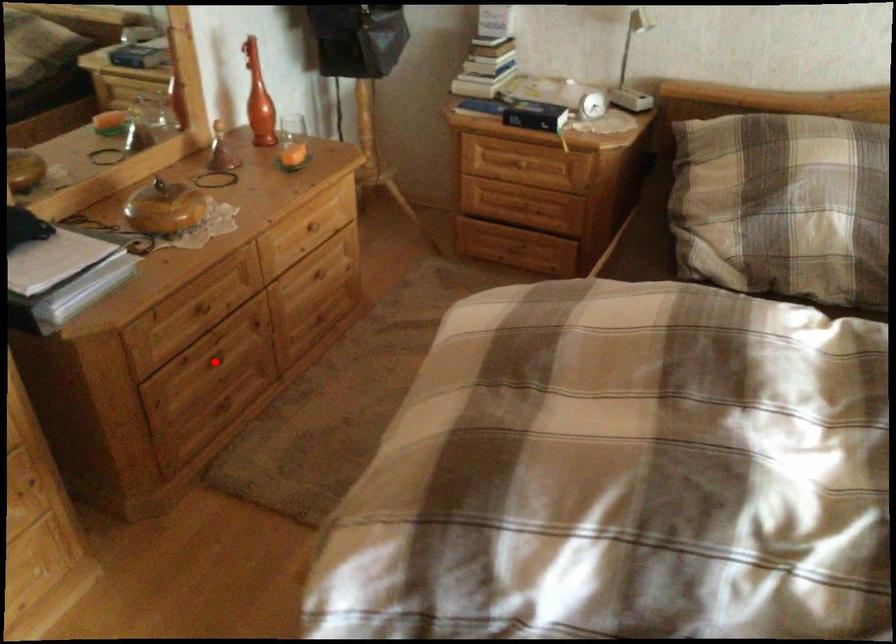
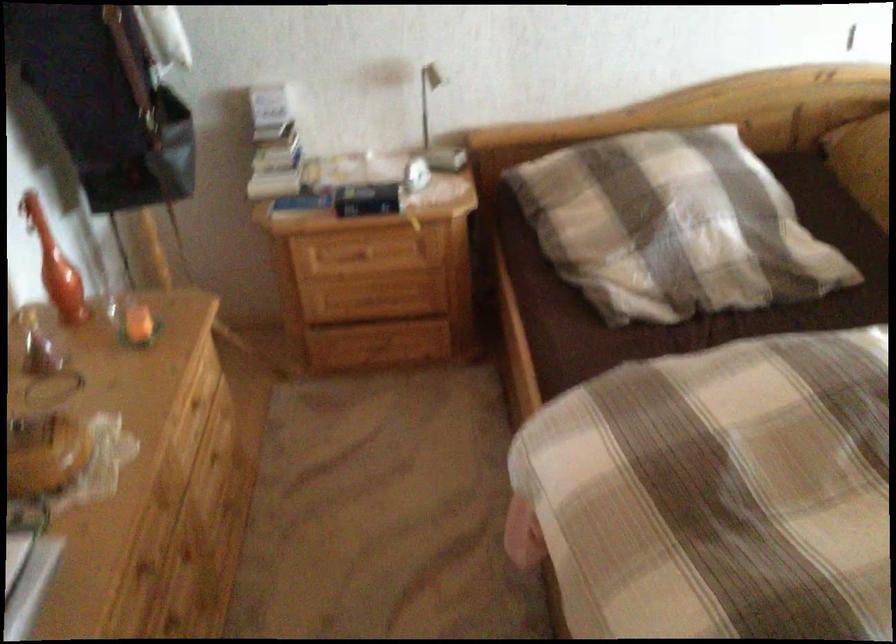
Question: I am providing you with two images of the same scene from different viewpoints. In image1, a red point is highlighted. Considering the same 3D point in image2, which of the following is correct?

Choices:
 (A) It is closer
 (B) It is farther

Answer: (A)